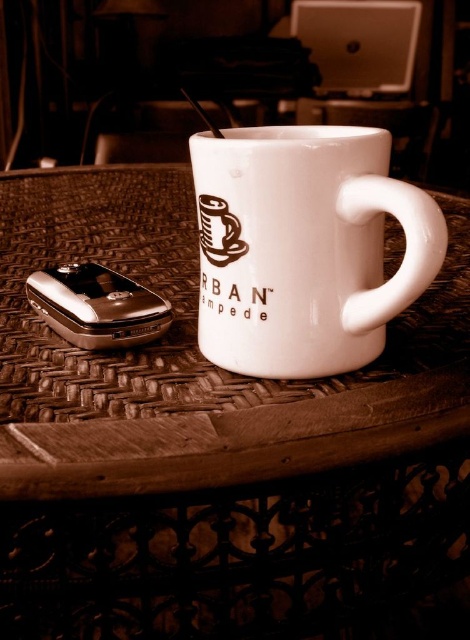
Between point (242, 262) and point (102, 269), which one is positioned behind?

Positioned behind is point (102, 269).

Between white glossy mug at center and metallic silver phone at lower left, which one has more height?

white glossy mug at center

Between point (249, 296) and point (140, 316), which one is positioned behind?

The point (140, 316) is more distant.

Locate an element on the screen. white glossy mug at center is located at coordinates (304, 248).

In the scene shown: Between white wicker table at center and white glossy mug at center, which one appears on the right side from the viewer's perspective?

white glossy mug at center is more to the right.

What do you see at coordinates (195, 358) in the screenshot? I see `white wicker table at center` at bounding box center [195, 358].

Where is `white wicker table at center`? white wicker table at center is located at coordinates (195, 358).

At what (x,y) coordinates should I click in order to perform the action: click on white wicker table at center. Please return your answer as a coordinate pair (x, y). This screenshot has height=640, width=470. Looking at the image, I should click on (195, 358).

Who is positioned more to the right, white wicker table at center or metallic silver phone at lower left?

white wicker table at center is more to the right.

The image size is (470, 640). I want to click on white wicker table at center, so [x=195, y=358].

Which is behind, point (391, 362) or point (75, 314)?

Point (75, 314)

Identify the location of white wicker table at center. The image size is (470, 640). (195, 358).